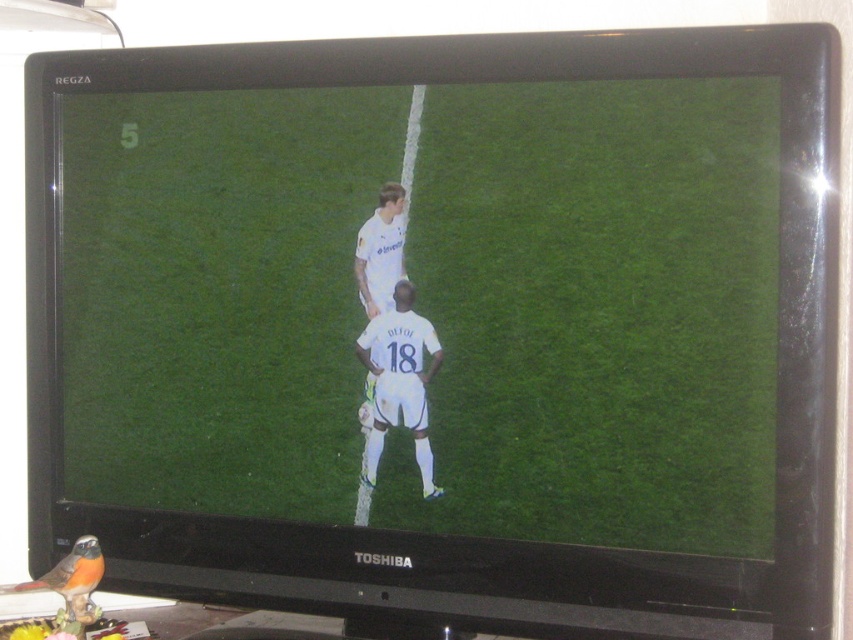
Who is shorter, white smooth soccer player at center or white matte soccer player at center?

white smooth soccer player at center

Where is `white smooth soccer player at center`? The image size is (853, 640). white smooth soccer player at center is located at coordinates (399, 381).

Locate an element on the screen. This screenshot has height=640, width=853. white smooth soccer player at center is located at coordinates (399, 381).

Is white matte soccer players at center behind white smooth soccer player at center?

No.

Who is lower down, white matte soccer players at center or white smooth soccer player at center?

white smooth soccer player at center is below.

Between point (708, 269) and point (364, 362), which one is positioned in front?

Point (708, 269) is more forward.

Locate an element on the screen. The width and height of the screenshot is (853, 640). white matte soccer players at center is located at coordinates (430, 305).

Which is more to the right, white matte soccer players at center or white matte soccer player at center?

From the viewer's perspective, white matte soccer players at center appears more on the right side.

Is point (619, 449) in front of point (395, 221)?

That is True.

Identify the location of white matte soccer players at center. The width and height of the screenshot is (853, 640). (430, 305).